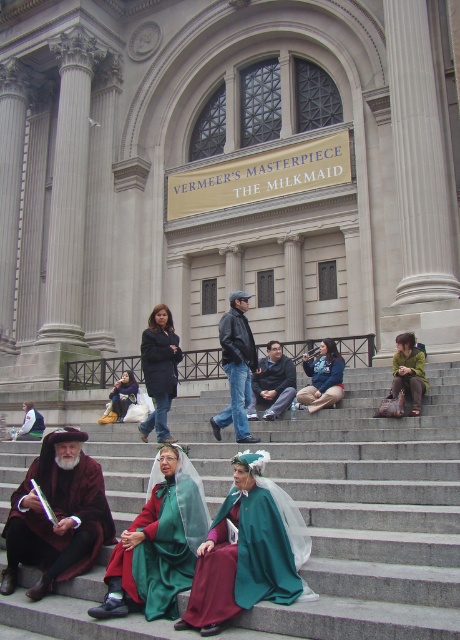
Question: Does smooth stone stairs at center lie in front of maroon velvet robe at lower left?

Choices:
 (A) no
 (B) yes

Answer: (B)

Question: Which object is positioned closest to the green velvet cape at lower right?

Choices:
 (A) smooth stone stairs at center
 (B) velvet black coat at center
 (C) dark blue leather jacket at center

Answer: (A)

Question: Does smooth stone stairs at center have a larger size compared to green velvet cape at lower center?

Choices:
 (A) yes
 (B) no

Answer: (A)

Question: Is green velvet cape at lower right further to the viewer compared to matte black jacket at lower left?

Choices:
 (A) no
 (B) yes

Answer: (A)

Question: Which point is closer to the camera taking this photo?

Choices:
 (A) (139, 579)
 (B) (394, 365)
 (C) (262, 368)
 (D) (28, 404)

Answer: (A)

Question: Which object is closer to the camera taking this photo?

Choices:
 (A) green velvet cape at lower right
 (B) matte black jacket at lower left
 (C) green velvet cape at lower center
 (D) maroon velvet robe at lower left

Answer: (C)